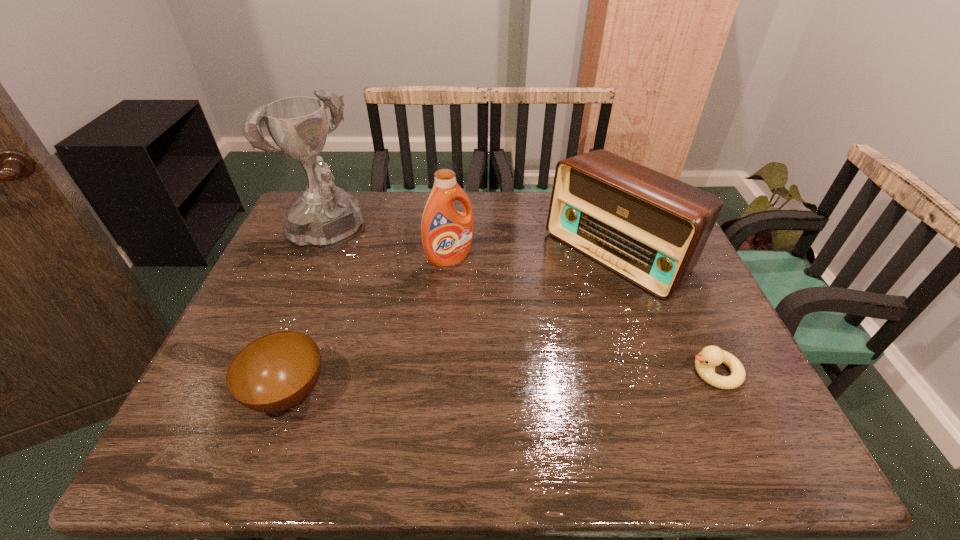
Locate an element on the screen. The height and width of the screenshot is (540, 960). object situated at the near right corner is located at coordinates (710, 356).

Identify the location of free space at the far edge of the desktop. (372, 191).

Identify the location of free location at the near edge. This screenshot has height=540, width=960. (654, 390).

Locate an element on the screen. The image size is (960, 540). free space at the left edge of the desktop is located at coordinates (300, 310).

I want to click on vacant space at the right edge, so click(674, 345).

At what (x,y) coordinates should I click in order to perform the action: click on vacant space at the near right corner of the desktop. Please return your answer as a coordinate pair (x, y). The width and height of the screenshot is (960, 540). Looking at the image, I should click on (762, 407).

Where is `free spot between the bowl and the duckling`? This screenshot has width=960, height=540. free spot between the bowl and the duckling is located at coordinates (501, 382).

The width and height of the screenshot is (960, 540). I want to click on empty space that is in between the detergent and the tallest object, so click(x=387, y=247).

Where is `empty space that is in between the bowl and the award`? empty space that is in between the bowl and the award is located at coordinates 306,315.

Identify the location of free space between the award and the duckling. This screenshot has height=540, width=960. (519, 304).